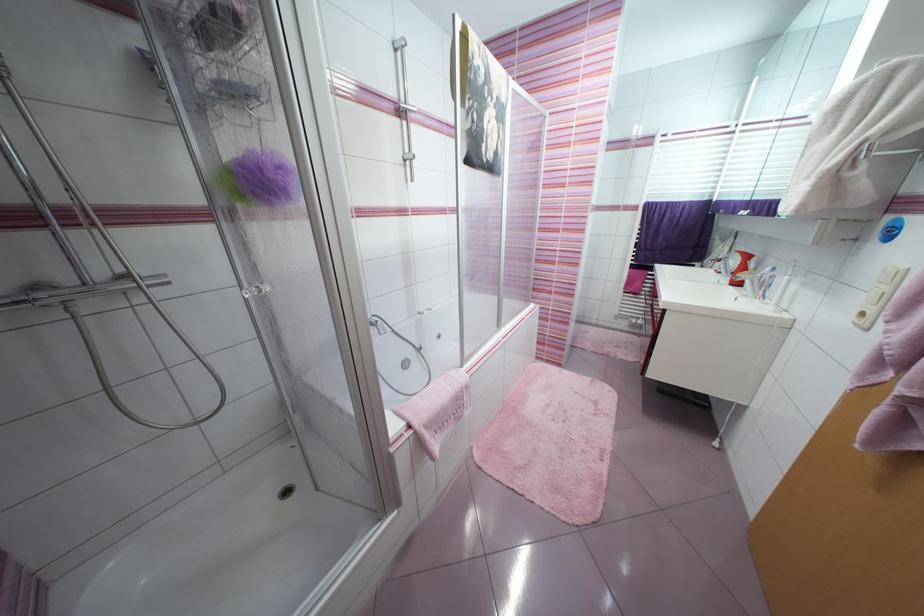
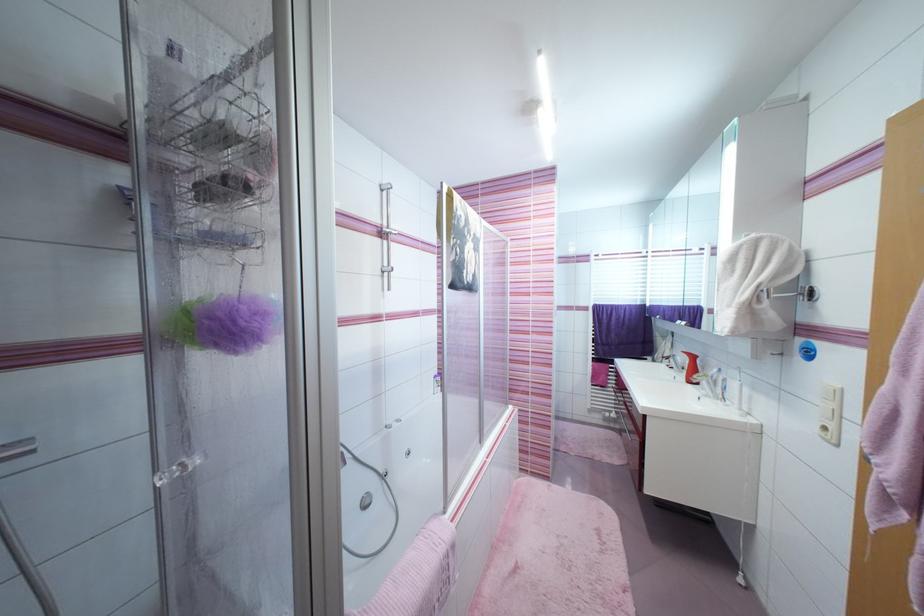
Locate, in the second image, the point that corresponds to the point at 403,122 in the first image.

(383, 241)